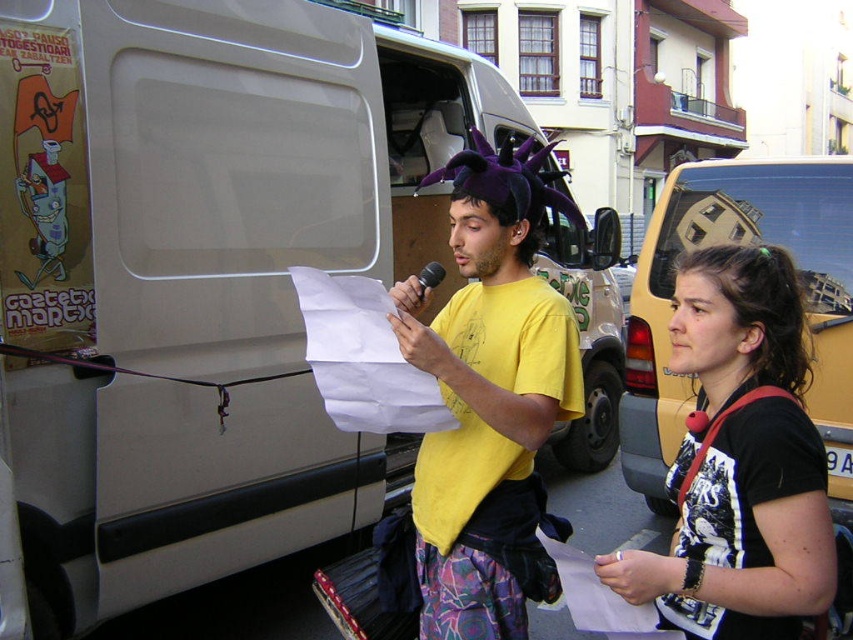
You are a delivery person who needs to load a large package into the matte white van at center. The package is taller than the black fabric backpack at lower right. Can you fit the package into the van?

The matte white van at center is taller than the black fabric backpack at lower right. Since the package is taller than the backpack, it may still fit in the van as the van is taller than the backpack. However, you should measure the package dimensions against the van to confirm.

You are standing in the street scene and want to place a small flowerpot between the two points, point [677,291] and point [310,284]. Which point should the flowerpot be closer to in order to be closer to the speaker?

The flowerpot should be placed closer to point [677,291] because it is closer to the speaker than point [310,284].